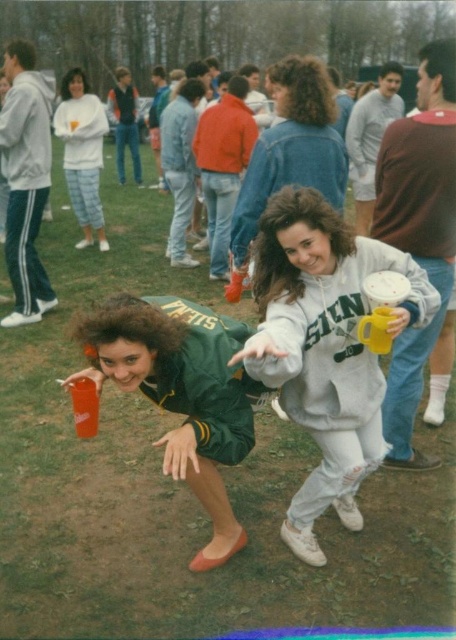
Question: Does green fabric jacket at center come behind yellow matte cup at center?

Choices:
 (A) no
 (B) yes

Answer: (A)

Question: Among these objects, which one is farthest from the camera?

Choices:
 (A) green fabric jacket at center
 (B) white fleece sweatshirt at upper left
 (C) translucent plastic cup at lower left

Answer: (B)

Question: Is denim jacket at upper center above yellow matte cup at center?

Choices:
 (A) no
 (B) yes

Answer: (B)

Question: Does denim jacket at upper center have a lesser width compared to yellow matte cup at center?

Choices:
 (A) yes
 (B) no

Answer: (B)

Question: Estimate the real-world distances between objects in this image. Which object is closer to the yellow matte cup at center?

Choices:
 (A) white fleece sweatshirt at center
 (B) white fleece sweatshirt at upper left

Answer: (A)

Question: Which of the following is the closest to the observer?

Choices:
 (A) yellow matte cup at center
 (B) white fleece sweatshirt at center
 (C) white fleece sweatshirt at upper left
 (D) translucent plastic cup at lower left

Answer: (B)